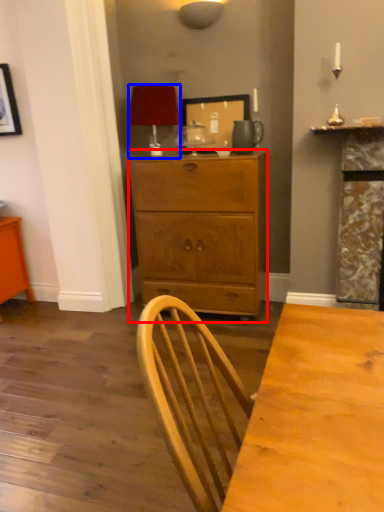
Question: Which of the following is the closest to the observer, chest of drawers (highlighted by a red box) or lamp (highlighted by a blue box)?

Choices:
 (A) chest of drawers
 (B) lamp

Answer: (A)